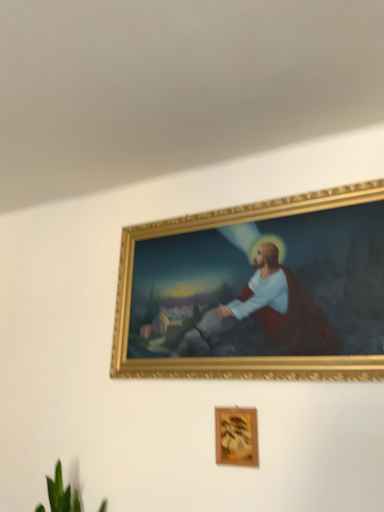
Image resolution: width=384 pixels, height=512 pixels. Identify the location of wooden frame at lower center, arranged as the first picture frame when ordered from the bottom. (236, 436).

Locate an element on the screen. This screenshot has width=384, height=512. gold/gilded picture frame at upper center, which is the first picture frame from right to left is located at coordinates (257, 291).

Find the location of a particular element. The image size is (384, 512). wooden frame at lower center, arranged as the first picture frame when ordered from the bottom is located at coordinates (236, 436).

Does green leafy plant at lower left appear on the right side of gold/gilded picture frame at upper center, positioned as the 1th picture frame in top-to-bottom order?

In fact, green leafy plant at lower left is to the left of gold/gilded picture frame at upper center, positioned as the 1th picture frame in top-to-bottom order.

Is green leafy plant at lower left thinner than gold/gilded picture frame at upper center, positioned as the 1th picture frame in top-to-bottom order?

Incorrect, the width of green leafy plant at lower left is not less than that of gold/gilded picture frame at upper center, positioned as the 1th picture frame in top-to-bottom order.

There is a green leafy plant at lower left. Where is `the 2nd picture frame above it (from a real-world perspective)`? the 2nd picture frame above it (from a real-world perspective) is located at coordinates pos(257,291).

Would you say green leafy plant at lower left is a long distance from gold/gilded picture frame at upper center, which is the first picture frame from right to left?

No.

How far apart are gold/gilded picture frame at upper center, positioned as the second picture frame in left-to-right order, and green leafy plant at lower left?

gold/gilded picture frame at upper center, positioned as the second picture frame in left-to-right order, is 33.64 inches away from green leafy plant at lower left.

Does point (137, 230) come farther from viewer compared to point (37, 511)?

Yes, it is.

Find the location of a particular element. This screenshot has width=384, height=512. plant below the gold/gilded picture frame at upper center, which is the first picture frame from right to left (from the image's perspective) is located at coordinates (65, 490).

Which object is further away from the camera, gold/gilded picture frame at upper center, positioned as the 1th picture frame in top-to-bottom order, or green leafy plant at lower left?

green leafy plant at lower left.

Which of these two, green leafy plant at lower left or wooden frame at lower center, placed as the second picture frame when sorted from right to left, is smaller?

With smaller size is wooden frame at lower center, placed as the second picture frame when sorted from right to left.

Which of these two, green leafy plant at lower left or wooden frame at lower center, placed as the second picture frame when sorted from right to left, is wider?

green leafy plant at lower left is wider.

From a real-world perspective, is green leafy plant at lower left below wooden frame at lower center, which is the first picture frame in left-to-right order?

Yes.

How different are the orientations of green leafy plant at lower left and wooden frame at lower center, which is the first picture frame in left-to-right order, in degrees?

The facing directions of green leafy plant at lower left and wooden frame at lower center, which is the first picture frame in left-to-right order, are 1.3 degrees apart.

Which object is positioned more to the right, gold/gilded picture frame at upper center, which is the first picture frame from right to left, or wooden frame at lower center, which is the first picture frame in left-to-right order?

From the viewer's perspective, gold/gilded picture frame at upper center, which is the first picture frame from right to left, appears more on the right side.

The image size is (384, 512). In order to click on picture frame above the wooden frame at lower center, which is the first picture frame in left-to-right order (from a real-world perspective) in this screenshot , I will do `click(257, 291)`.

Could you measure the distance between gold/gilded picture frame at upper center, positioned as the second picture frame in left-to-right order, and wooden frame at lower center, positioned as the second picture frame in top-to-bottom order?

They are 16.15 inches apart.

Between gold/gilded picture frame at upper center, positioned as the 1th picture frame in top-to-bottom order, and wooden frame at lower center, arranged as the first picture frame when ordered from the bottom, which one has smaller size?

With smaller size is wooden frame at lower center, arranged as the first picture frame when ordered from the bottom.

Are wooden frame at lower center, arranged as the first picture frame when ordered from the bottom, and green leafy plant at lower left far apart?

No, wooden frame at lower center, arranged as the first picture frame when ordered from the bottom, is in close proximity to green leafy plant at lower left.

From a real-world perspective, which is physically above, wooden frame at lower center, arranged as the first picture frame when ordered from the bottom, or green leafy plant at lower left?

wooden frame at lower center, arranged as the first picture frame when ordered from the bottom.

How much distance is there between wooden frame at lower center, arranged as the first picture frame when ordered from the bottom, and green leafy plant at lower left?

A distance of 59.89 centimeters exists between wooden frame at lower center, arranged as the first picture frame when ordered from the bottom, and green leafy plant at lower left.

Can you confirm if wooden frame at lower center, which is the first picture frame in left-to-right order, is smaller than green leafy plant at lower left?

Yes, wooden frame at lower center, which is the first picture frame in left-to-right order, is smaller than green leafy plant at lower left.

How much distance is there between wooden frame at lower center, placed as the second picture frame when sorted from right to left, and gold/gilded picture frame at upper center, positioned as the 1th picture frame in top-to-bottom order?

A distance of 16.15 inches exists between wooden frame at lower center, placed as the second picture frame when sorted from right to left, and gold/gilded picture frame at upper center, positioned as the 1th picture frame in top-to-bottom order.

From a real-world perspective, which object rests below the other?

wooden frame at lower center, arranged as the first picture frame when ordered from the bottom, is physically lower.

Between wooden frame at lower center, which is the first picture frame in left-to-right order, and gold/gilded picture frame at upper center, positioned as the 1th picture frame in top-to-bottom order, which one has less height?

With less height is wooden frame at lower center, which is the first picture frame in left-to-right order.

Find the location of a particular element. This screenshot has height=512, width=384. plant behind the gold/gilded picture frame at upper center, positioned as the 1th picture frame in top-to-bottom order is located at coordinates (65, 490).

This screenshot has height=512, width=384. Identify the location of plant beneath the gold/gilded picture frame at upper center, positioned as the 1th picture frame in top-to-bottom order (from a real-world perspective). (65, 490).

Based on the photo, which object lies further to the anchor point gold/gilded picture frame at upper center, positioned as the 1th picture frame in top-to-bottom order, green leafy plant at lower left or wooden frame at lower center, positioned as the second picture frame in top-to-bottom order?

Based on the image, green leafy plant at lower left appears to be further to gold/gilded picture frame at upper center, positioned as the 1th picture frame in top-to-bottom order.

Looking at the image, which one is located closer to wooden frame at lower center, arranged as the first picture frame when ordered from the bottom, green leafy plant at lower left or gold/gilded picture frame at upper center, positioned as the 1th picture frame in top-to-bottom order?

The object closer to wooden frame at lower center, arranged as the first picture frame when ordered from the bottom, is gold/gilded picture frame at upper center, positioned as the 1th picture frame in top-to-bottom order.

Looking at the image, which one is located further to green leafy plant at lower left, wooden frame at lower center, arranged as the first picture frame when ordered from the bottom, or gold/gilded picture frame at upper center, acting as the 2th picture frame starting from the bottom?

Among the two, gold/gilded picture frame at upper center, acting as the 2th picture frame starting from the bottom, is located further to green leafy plant at lower left.

Estimate the real-world distances between objects in this image. Which object is further from green leafy plant at lower left, gold/gilded picture frame at upper center, which is the first picture frame from right to left, or wooden frame at lower center, placed as the second picture frame when sorted from right to left?

gold/gilded picture frame at upper center, which is the first picture frame from right to left.

Consider the image. When comparing their distances from gold/gilded picture frame at upper center, acting as the 2th picture frame starting from the bottom, does wooden frame at lower center, positioned as the second picture frame in top-to-bottom order, or green leafy plant at lower left seem further?

green leafy plant at lower left is positioned further to the anchor gold/gilded picture frame at upper center, acting as the 2th picture frame starting from the bottom.

Looking at the image, which one is located closer to wooden frame at lower center, positioned as the second picture frame in top-to-bottom order, gold/gilded picture frame at upper center, which is the first picture frame from right to left, or green leafy plant at lower left?

gold/gilded picture frame at upper center, which is the first picture frame from right to left.

You are a GUI agent. You are given a task and a screenshot of the screen. Output one action in this format:
    pyautogui.click(x=<x>, y=<y>)
    Task: Click on the picture frame between gold/gilded picture frame at upper center, positioned as the second picture frame in left-to-right order, and green leafy plant at lower left from top to bottom
    This screenshot has width=384, height=512.
    Given the screenshot: What is the action you would take?
    pyautogui.click(x=236, y=436)